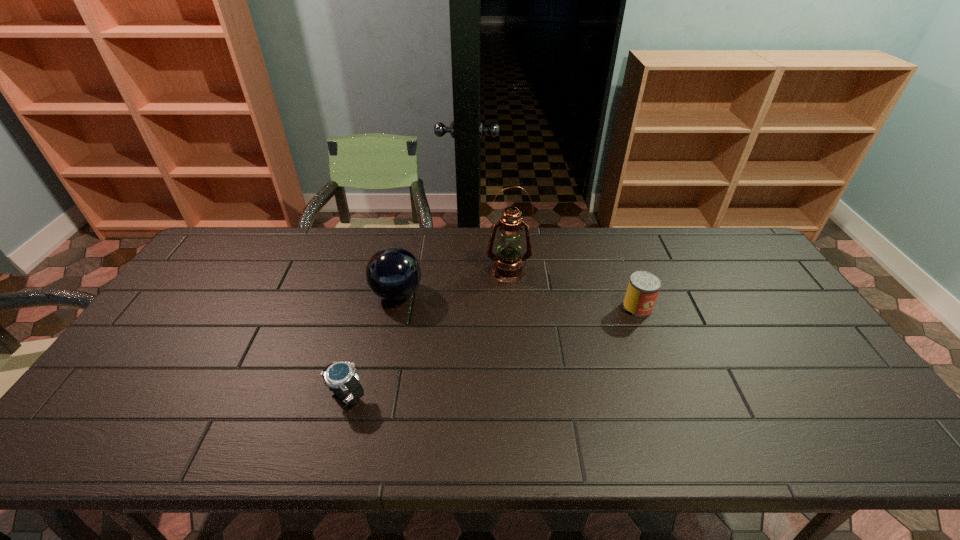
The height and width of the screenshot is (540, 960). What are the coordinates of `vacant space that satisfies the following two spatial constraints: 1. on the back side of the rightmost object; 2. on the side of the bowling ball with the finger holes` in the screenshot? It's located at (633, 294).

Where is `free region that satisfies the following two spatial constraints: 1. on the side of the third shortest object with the finger holes; 2. on the left side of the can`? The image size is (960, 540). free region that satisfies the following two spatial constraints: 1. on the side of the third shortest object with the finger holes; 2. on the left side of the can is located at coordinates (394, 307).

This screenshot has height=540, width=960. I want to click on free location that satisfies the following two spatial constraints: 1. on the back side of the rightmost object; 2. on the right side of the nearest object, so click(371, 307).

This screenshot has height=540, width=960. I want to click on vacant space that satisfies the following two spatial constraints: 1. on the side of the bowling ball with the finger holes; 2. on the left side of the can, so [x=394, y=307].